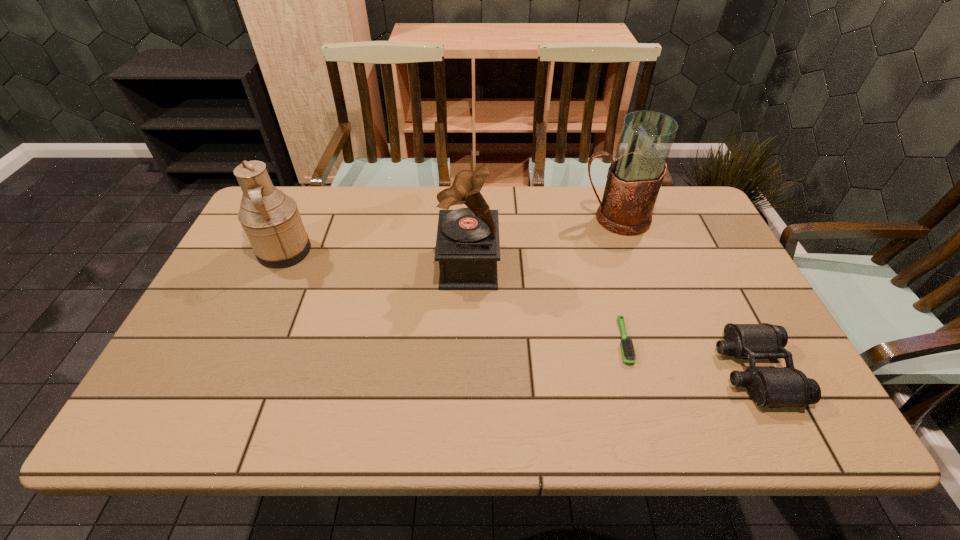
Where is `vacant region located on the right of the left pitcher`? vacant region located on the right of the left pitcher is located at coordinates (369, 252).

I want to click on vacant space located 0.390m through the eyepieces of the rightmost object, so click(550, 370).

Locate an element on the screen. Image resolution: width=960 pixels, height=540 pixels. free location located 0.290m through the eyepieces of the rightmost object is located at coordinates (593, 370).

Identify the location of vacant space located through the eyepieces of the rightmost object. This screenshot has width=960, height=540. (581, 370).

Find the location of a particular element. This screenshot has height=540, width=960. vacant area situated 0.120m on the right of the shortest object is located at coordinates (680, 341).

I want to click on object located in the far edge section of the desktop, so click(634, 178).

Image resolution: width=960 pixels, height=540 pixels. I want to click on object at the near edge, so click(x=768, y=387).

What are the coordinates of `object that is at the left edge` in the screenshot? It's located at (271, 220).

This screenshot has width=960, height=540. Find the location of `object located in the right edge section of the desktop`. object located in the right edge section of the desktop is located at coordinates (768, 387).

I want to click on object present at the near right corner, so 768,387.